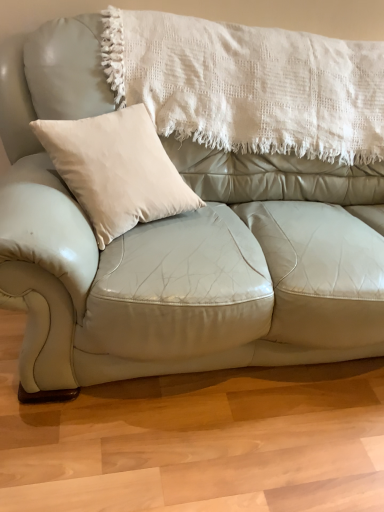
Describe the element at coordinates (248, 85) in the screenshot. I see `white woven blanket at upper center` at that location.

You are a GUI agent. You are given a task and a screenshot of the screen. Output one action in this format:
    pyautogui.click(x=<x>, y=<y>)
    Task: Click on the white woven blanket at upper center
    Image resolution: width=384 pixels, height=512 pixels.
    Given the screenshot: What is the action you would take?
    pyautogui.click(x=248, y=85)

This screenshot has height=512, width=384. Find the location of `white woven blanket at upper center`. white woven blanket at upper center is located at coordinates (248, 85).